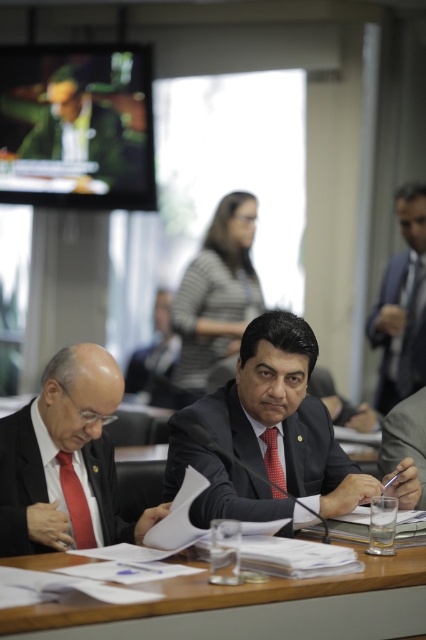
You are a tailor who needs to determine which suit requires more fabric for alterations. Based on the image, which suit between the satin blue suit at right and the gray fabric suit at center would need more fabric due to its larger size?

The satin blue suit at right requires more fabric for alterations because its width is larger than the gray fabric suit at center.

Looking at this image, you are an event planner arranging a photoshoot in this meeting room. You need to position a large backdrop behind the satin blue suit at right and the gray fabric suit at center. Since the backdrop needs to be placed behind the farther object, where should you place it?

The gray fabric suit at center is farther from the viewer than the satin blue suit at right. Therefore, the backdrop should be placed behind the gray fabric suit at center.

You are a photographer standing in front of the meeting table. You want to take a photo that includes both the point at position (106, 113) and the point at position (72, 474). Which point should you focus on first to ensure both are in focus?

You should focus on the point at position (106, 113) first because it is closer to you than the point at position (72, 474). By focusing on the closer point, the farther point will also be within the depth of field and in focus.